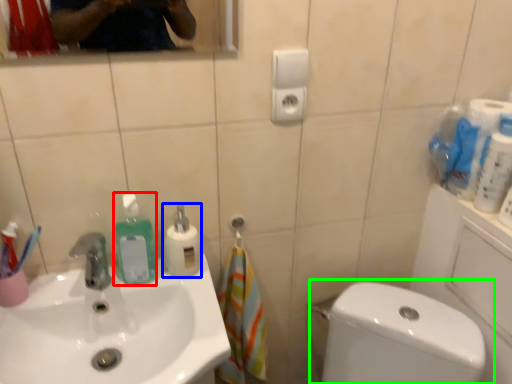
Question: Based on their relative distances, which object is farther from cleaning product (highlighted by a red box)? Choose from cleaning product (highlighted by a blue box) and toilet (highlighted by a green box).

Choices:
 (A) cleaning product
 (B) toilet

Answer: (B)